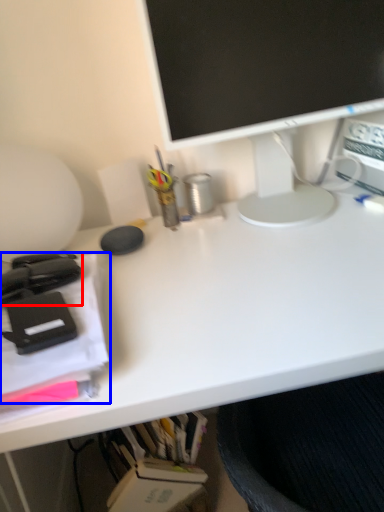
Question: Which object is closer to the camera taking this photo, office supplies (highlighted by a red box) or office supplies (highlighted by a blue box)?

Choices:
 (A) office supplies
 (B) office supplies

Answer: (B)